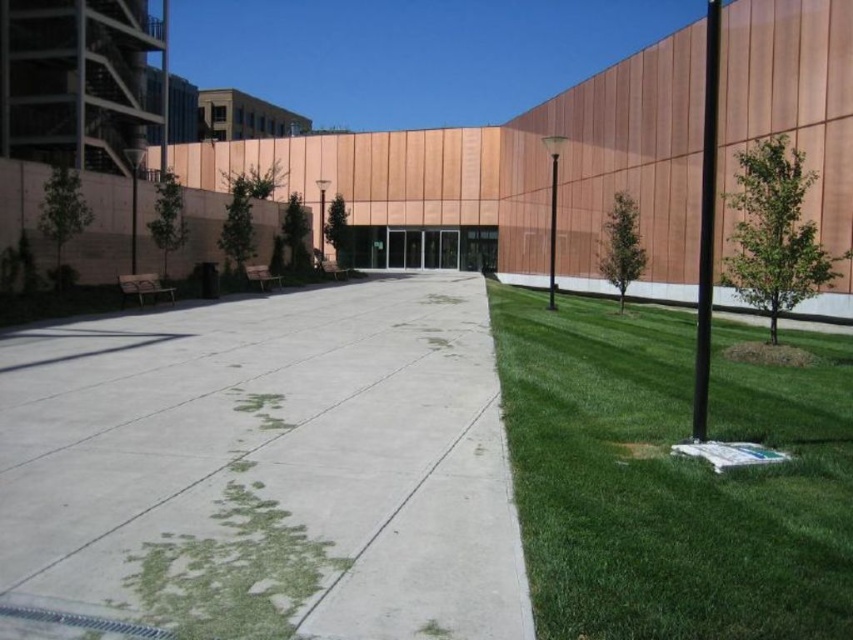
Question: Which point is farther to the camera?

Choices:
 (A) (404, 618)
 (B) (650, 323)

Answer: (B)

Question: Which point is farther to the camera?

Choices:
 (A) (782, 372)
 (B) (236, 477)

Answer: (A)

Question: Is white concrete pavement at center above green grass at right?

Choices:
 (A) yes
 (B) no

Answer: (A)

Question: Is white concrete pavement at center closer to camera compared to green grass at right?

Choices:
 (A) no
 (B) yes

Answer: (B)

Question: Is white concrete pavement at center smaller than green grass at right?

Choices:
 (A) yes
 (B) no

Answer: (B)